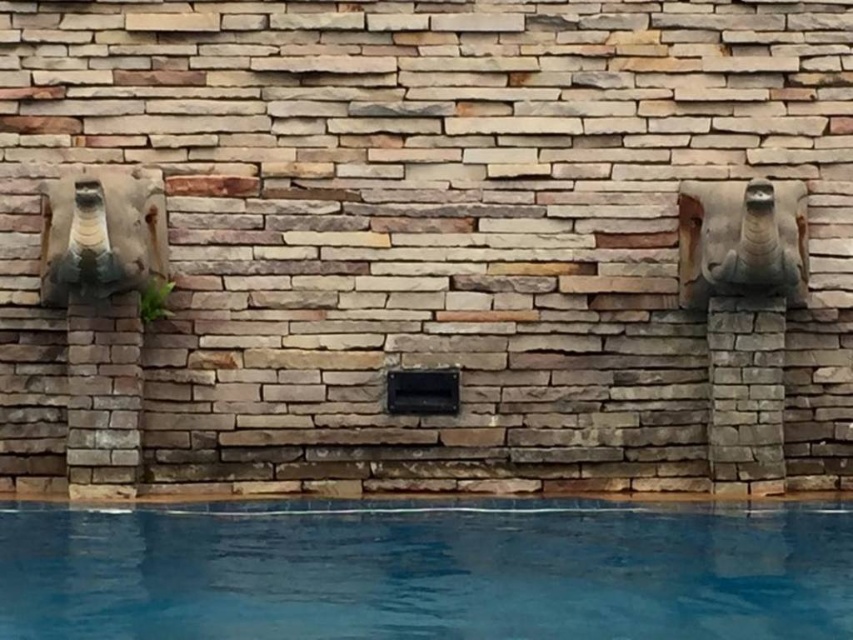
Which of these two, bronze statue at left or stone-like elephant head at right, stands taller?

bronze statue at left is taller.

Is bronze statue at left further to camera compared to stone-like elephant head at right?

No, bronze statue at left is in front of stone-like elephant head at right.

Is point (57, 268) behind point (727, 189)?

No, it is in front of (727, 189).

This screenshot has width=853, height=640. Find the location of `bronze statue at left`. bronze statue at left is located at coordinates (102, 234).

Is blue smooth water at bottom to the left of stone-like elephant head at right from the viewer's perspective?

Indeed, blue smooth water at bottom is positioned on the left side of stone-like elephant head at right.

Is blue smooth water at bottom closer to camera compared to stone-like elephant head at right?

Yes, it is in front of stone-like elephant head at right.

Is point (230, 595) behind point (686, 225)?

No, it is in front of (686, 225).

Where is `blue smooth water at bottom`? blue smooth water at bottom is located at coordinates (425, 572).

Does point (26, 508) lie behind point (84, 177)?

Yes.

Can you confirm if blue smooth water at bottom is positioned to the left of bronze statue at left?

In fact, blue smooth water at bottom is to the right of bronze statue at left.

Locate an element on the screen. Image resolution: width=853 pixels, height=640 pixels. blue smooth water at bottom is located at coordinates (425, 572).